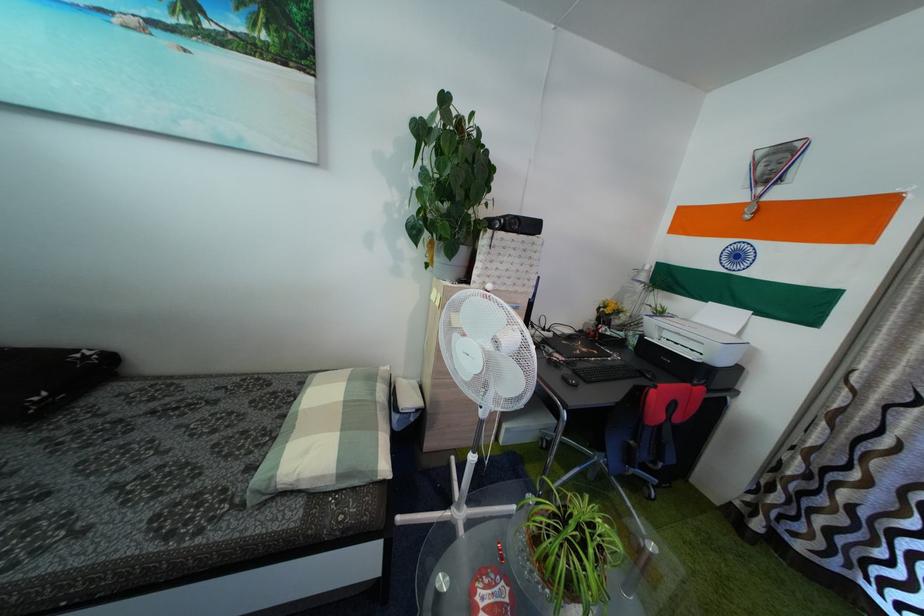
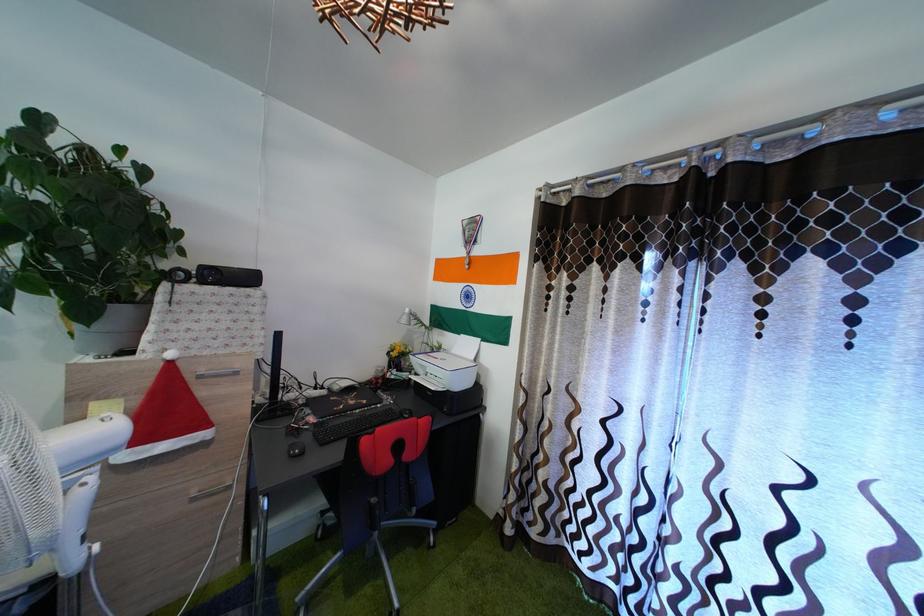
The point at (x=541, y=235) is marked in the first image. Where is the corresponding point in the second image?

(257, 286)